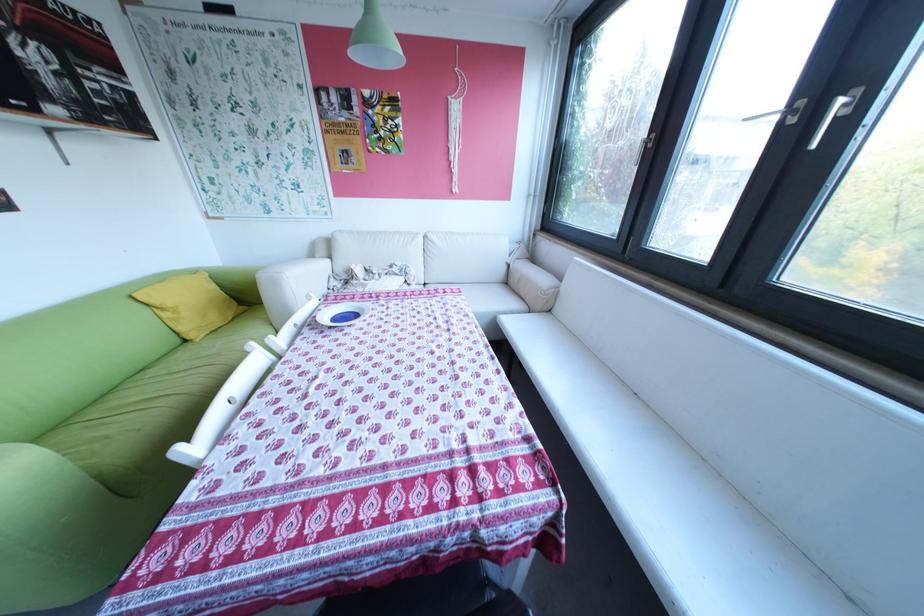
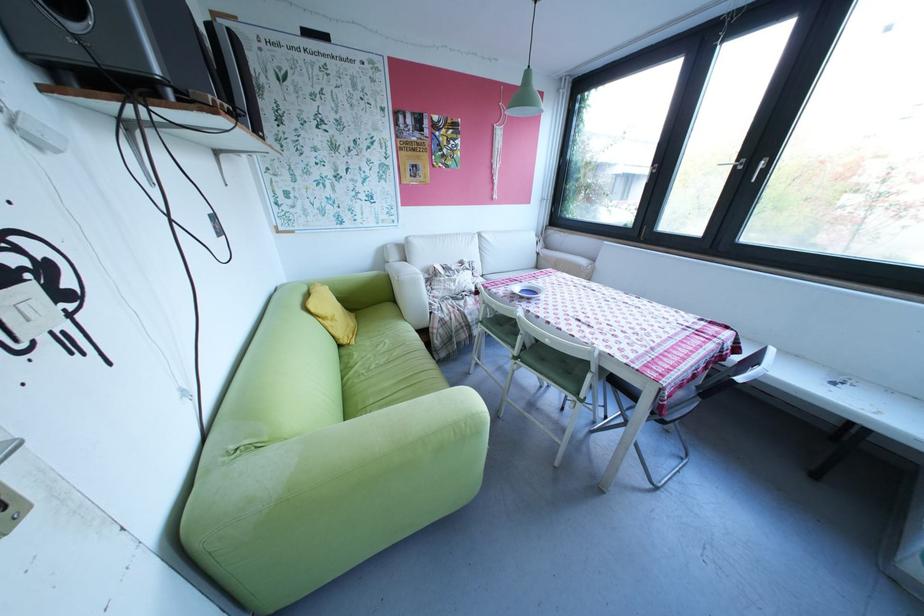
The point at [210,339] is marked in the first image. Where is the corresponding point in the second image?

(366, 342)